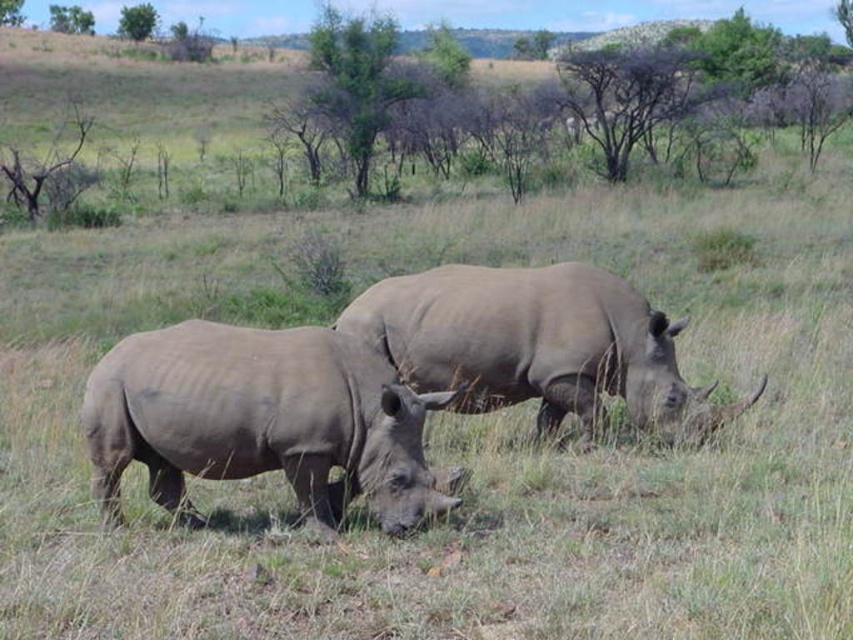
Question: Among these points, which one is farthest from the camera?

Choices:
 (A) (392, 524)
 (B) (531, 280)

Answer: (B)

Question: Is gray matte rhinoceros at lower left in front of gray matte rhinoceros at center?

Choices:
 (A) yes
 (B) no

Answer: (A)

Question: Among these points, which one is nearest to the camera?

Choices:
 (A) (503, 333)
 (B) (286, 442)

Answer: (B)

Question: Can you confirm if gray matte rhinoceros at lower left is wider than gray matte rhinoceros at center?

Choices:
 (A) no
 (B) yes

Answer: (A)

Question: Can you confirm if gray matte rhinoceros at lower left is positioned below gray matte rhinoceros at center?

Choices:
 (A) yes
 (B) no

Answer: (A)